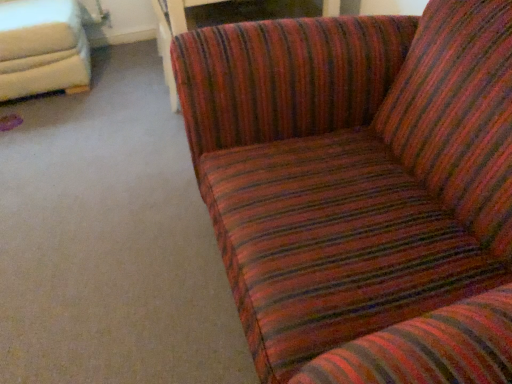
Question: Does striped fabric couch at upper right, the second studio couch positioned from the left, have a greater width compared to white leather studio couch at upper left, the first studio couch viewed from the left?

Choices:
 (A) no
 (B) yes

Answer: (B)

Question: Does striped fabric couch at upper right, the second studio couch positioned from the left, appear on the right side of white leather studio couch at upper left, the first studio couch viewed from the left?

Choices:
 (A) no
 (B) yes

Answer: (B)

Question: Considering the relative sizes of striped fabric couch at upper right, marked as the first studio couch in a right-to-left arrangement, and white leather studio couch at upper left, the first studio couch viewed from the left, in the image provided, is striped fabric couch at upper right, marked as the first studio couch in a right-to-left arrangement, thinner than white leather studio couch at upper left, the first studio couch viewed from the left,?

Choices:
 (A) yes
 (B) no

Answer: (B)

Question: Is striped fabric couch at upper right, marked as the first studio couch in a right-to-left arrangement, to the left of white leather studio couch at upper left, marked as the second studio couch in a right-to-left arrangement, from the viewer's perspective?

Choices:
 (A) yes
 (B) no

Answer: (B)

Question: Can white leather studio couch at upper left, the first studio couch viewed from the left, be found inside striped fabric couch at upper right, the second studio couch positioned from the left?

Choices:
 (A) yes
 (B) no

Answer: (B)

Question: Can you confirm if striped fabric couch at upper right, the second studio couch positioned from the left, is shorter than white leather studio couch at upper left, the first studio couch viewed from the left?

Choices:
 (A) yes
 (B) no

Answer: (A)

Question: Could you tell me if white leather studio couch at upper left, the first studio couch viewed from the left, is facing striped fabric couch at upper right, marked as the first studio couch in a right-to-left arrangement?

Choices:
 (A) yes
 (B) no

Answer: (B)

Question: Is white leather studio couch at upper left, marked as the second studio couch in a right-to-left arrangement, surrounding striped fabric couch at upper right, the second studio couch positioned from the left?

Choices:
 (A) no
 (B) yes

Answer: (A)

Question: From the image's perspective, is white leather studio couch at upper left, the first studio couch viewed from the left, above striped fabric couch at upper right, marked as the first studio couch in a right-to-left arrangement?

Choices:
 (A) no
 (B) yes

Answer: (B)

Question: Considering the relative sizes of white leather studio couch at upper left, marked as the second studio couch in a right-to-left arrangement, and striped fabric couch at upper right, the second studio couch positioned from the left, in the image provided, is white leather studio couch at upper left, marked as the second studio couch in a right-to-left arrangement, wider than striped fabric couch at upper right, the second studio couch positioned from the left,?

Choices:
 (A) no
 (B) yes

Answer: (A)

Question: Does white leather studio couch at upper left, the first studio couch viewed from the left, have a smaller size compared to striped fabric couch at upper right, the second studio couch positioned from the left?

Choices:
 (A) no
 (B) yes

Answer: (B)

Question: From the image's perspective, is white leather studio couch at upper left, marked as the second studio couch in a right-to-left arrangement, below striped fabric couch at upper right, the second studio couch positioned from the left?

Choices:
 (A) no
 (B) yes

Answer: (A)

Question: From the image's perspective, does wooden table at center appear higher than striped fabric couch at upper right, marked as the first studio couch in a right-to-left arrangement?

Choices:
 (A) no
 (B) yes

Answer: (B)